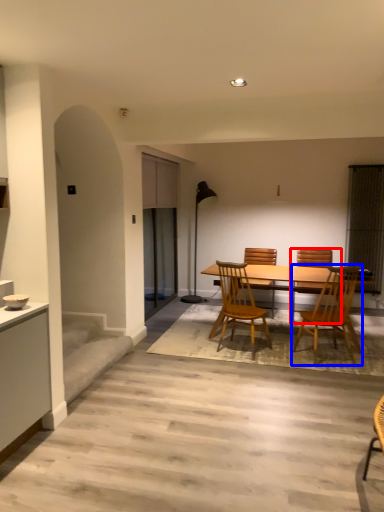
Question: Which object appears farthest to the camera in this image, chair (highlighted by a red box) or chair (highlighted by a blue box)?

Choices:
 (A) chair
 (B) chair

Answer: (A)